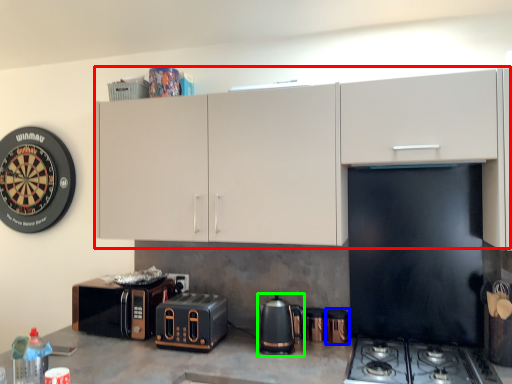
Question: Considering the real-world distances, which object is farthest from cabinetry (highlighted by a red box)? appliance (highlighted by a blue box) or kitchen appliance (highlighted by a green box)?

Choices:
 (A) appliance
 (B) kitchen appliance

Answer: (A)